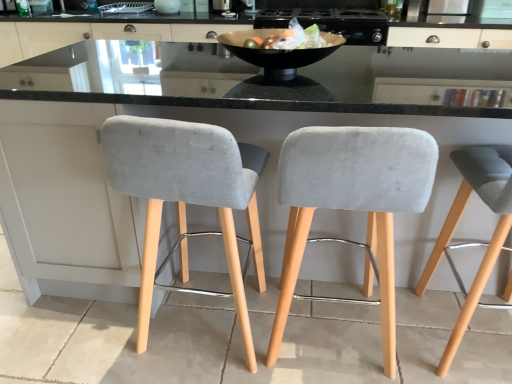
Question: Considering their positions, is black glossy bowl at center located in front of or behind velvet grey bar stool at left, which appears as the 1th chair when viewed from the left?

Choices:
 (A) front
 (B) behind

Answer: (B)

Question: Considering the positions of black glossy bowl at center and velvet grey bar stool at left, the third chair when ordered from right to left, in the image, is black glossy bowl at center taller or shorter than velvet grey bar stool at left, the third chair when ordered from right to left,?

Choices:
 (A) short
 (B) tall

Answer: (A)

Question: Considering the real-world distances, which object is farthest from the black glossy bowl at center?

Choices:
 (A) matte white cabinet at upper center
 (B) velvet grey bar stool at right, the 3th chair in the left-to-right sequence
 (C) velvet grey bar stool at left, the third chair when ordered from right to left
 (D) white glossy bowl at upper center, which is the 2th appliance in right-to-left order
 (E) metallic black pan at upper center, placed as the first appliance when sorted from right to left

Answer: (D)

Question: Which object is the closest to the velvet grey bar stool at right, the 3th chair in the left-to-right sequence?

Choices:
 (A) velvet grey bar stool at left, the third chair when ordered from right to left
 (B) white glossy bowl at upper center, which is the first appliance in left-to-right order
 (C) velvet grey chair at center, placed as the second chair when sorted from left to right
 (D) matte white cabinet at upper center
 (E) black glossy bowl at center

Answer: (C)